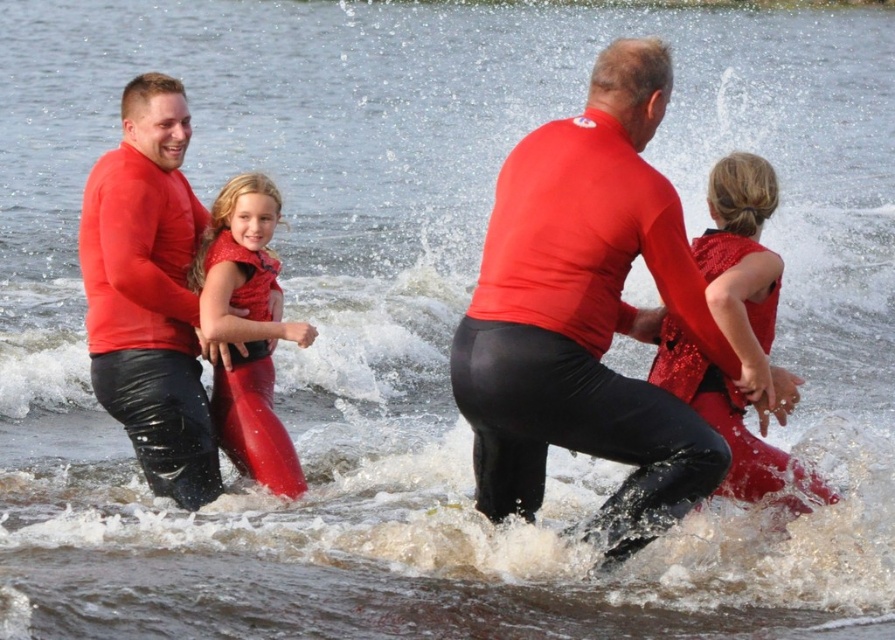
Question: Based on their relative distances, which object is farther from the shiny red wetsuit at center?

Choices:
 (A) shiny sequined vest at center
 (B) matte red wetsuit at center
 (C) shiny red life jacket at center
 (D) matte red wetsuit at left

Answer: (C)

Question: Which object is farther from the camera taking this photo?

Choices:
 (A) shiny red wetsuit at center
 (B) shiny sequined vest at center
 (C) matte red wetsuit at left

Answer: (A)

Question: Estimate the real-world distances between objects in this image. Which object is closer to the matte red wetsuit at center?

Choices:
 (A) matte red wetsuit at left
 (B) shiny red wetsuit at center

Answer: (B)

Question: Does matte red wetsuit at left come in front of shiny sequined vest at center?

Choices:
 (A) no
 (B) yes

Answer: (A)

Question: Is shiny sequined vest at center smaller than shiny red life jacket at center?

Choices:
 (A) yes
 (B) no

Answer: (B)

Question: Can you confirm if shiny sequined vest at center is wider than shiny red life jacket at center?

Choices:
 (A) no
 (B) yes

Answer: (B)